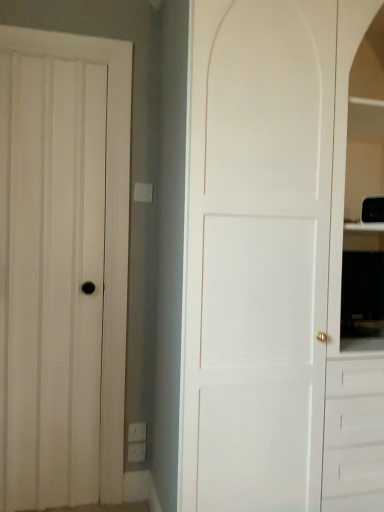
Question: Considering the relative positions of white matte door at left, arranged as the first door when viewed from the left, and white matte door at right, the first door positioned from the right, in the image provided, is white matte door at left, arranged as the first door when viewed from the left, to the left or to the right of white matte door at right, the first door positioned from the right,?

Choices:
 (A) left
 (B) right

Answer: (A)

Question: Considering the positions of point (129, 117) and point (312, 462), is point (129, 117) closer or farther from the camera than point (312, 462)?

Choices:
 (A) closer
 (B) farther

Answer: (B)

Question: From the image's perspective, is white matte door at left, arranged as the first door when viewed from the left, positioned above or below white matte door at right, the second door when ordered from left to right?

Choices:
 (A) above
 (B) below

Answer: (B)

Question: From the image's perspective, is white matte door at right, the second door when ordered from left to right, above or below white matte door at left, the 2th door from the right?

Choices:
 (A) below
 (B) above

Answer: (B)

Question: Is white matte door at right, the first door positioned from the right, bigger or smaller than white matte door at left, the 2th door from the right?

Choices:
 (A) big
 (B) small

Answer: (A)

Question: Which is correct: white matte door at right, the first door positioned from the right, is inside white matte door at left, arranged as the first door when viewed from the left, or outside of it?

Choices:
 (A) inside
 (B) outside

Answer: (B)

Question: Is white matte door at right, the first door positioned from the right, wider or thinner than white matte door at left, arranged as the first door when viewed from the left?

Choices:
 (A) wide
 (B) thin

Answer: (A)